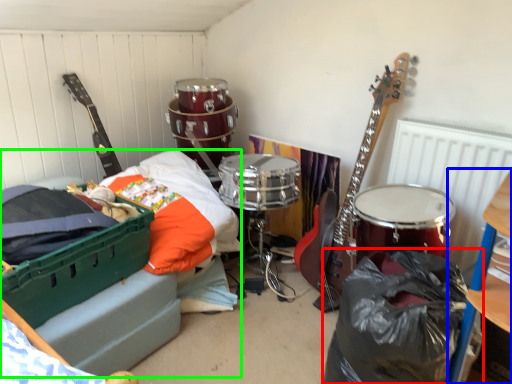
Question: Which object is the farthest from garbage (highlighted by a red box)? Choose among these: furniture (highlighted by a blue box) or bed (highlighted by a green box).

Choices:
 (A) furniture
 (B) bed

Answer: (B)